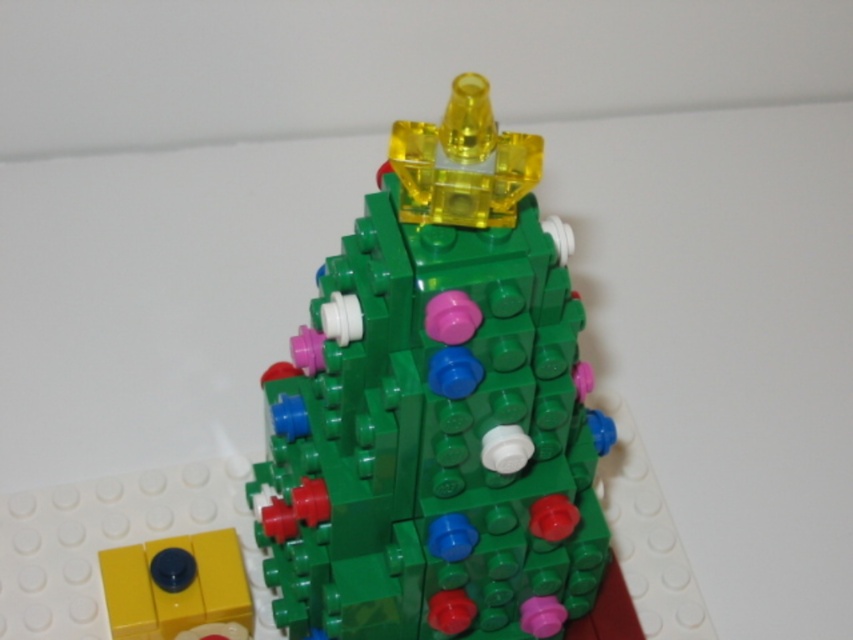
Is translucent yellow plastic at top shorter than matte yellow brick at bottom left?

In fact, translucent yellow plastic at top may be taller than matte yellow brick at bottom left.

Does translucent yellow plastic at top appear over matte yellow brick at bottom left?

Yes.

At what (x,y) coordinates should I click in order to perform the action: click on translucent yellow plastic at top. Please return your answer as a coordinate pair (x, y). Looking at the image, I should click on (437, 406).